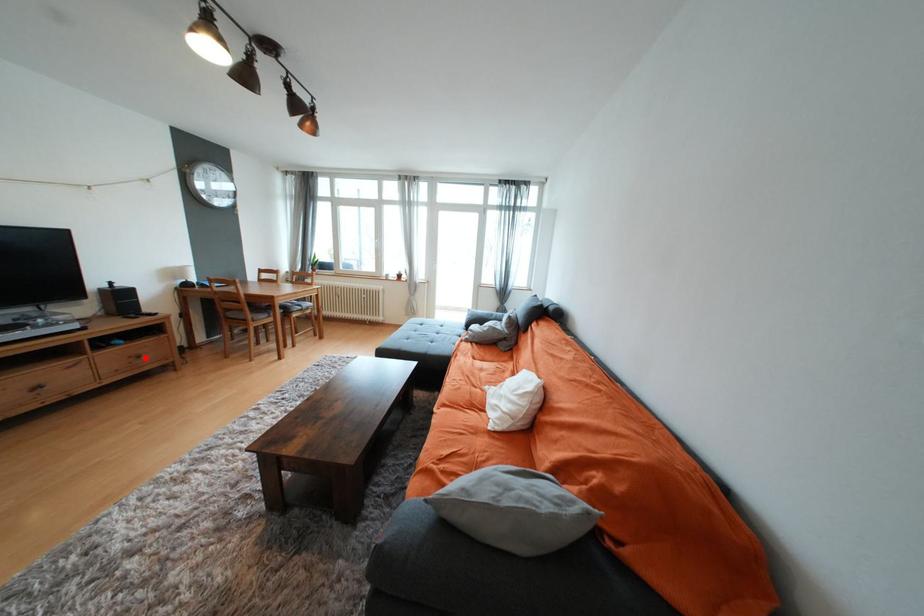
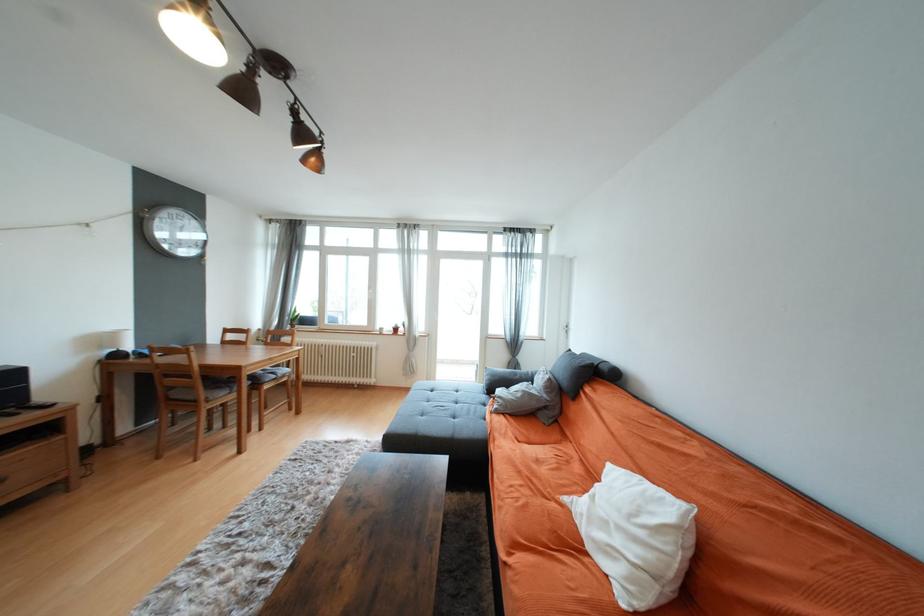
In the second image, find the point that corresponds to the highlighted location in the first image.

(7, 482)